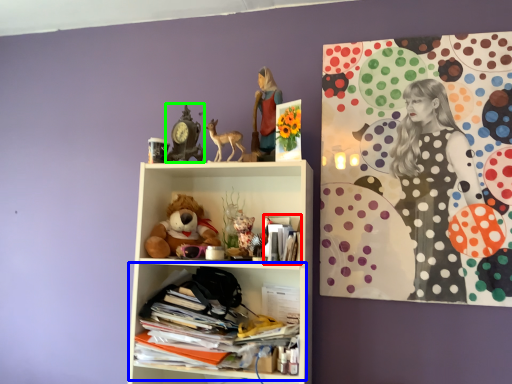
Question: Which is farther away from magazine (highlighted by a red box)? shelf (highlighted by a blue box) or art (highlighted by a green box)?

Choices:
 (A) shelf
 (B) art

Answer: (B)